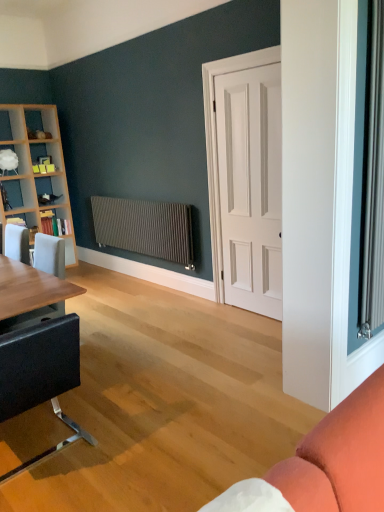
Image resolution: width=384 pixels, height=512 pixels. Identify the location of empty space that is ontop of matte coral fabric couch at lower right. (232, 451).